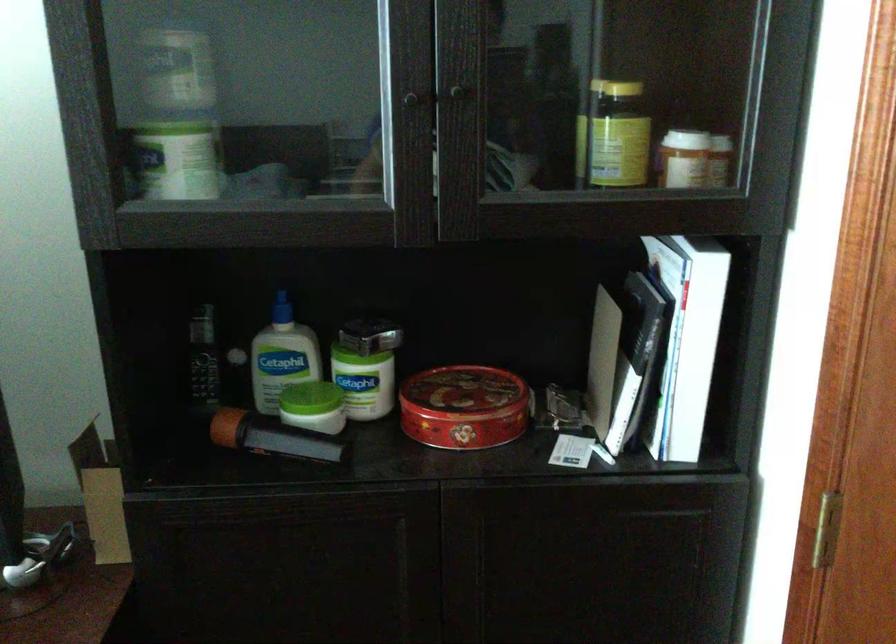
Find the location of `lotion bottle pump`. lotion bottle pump is located at coordinates (728, 373).